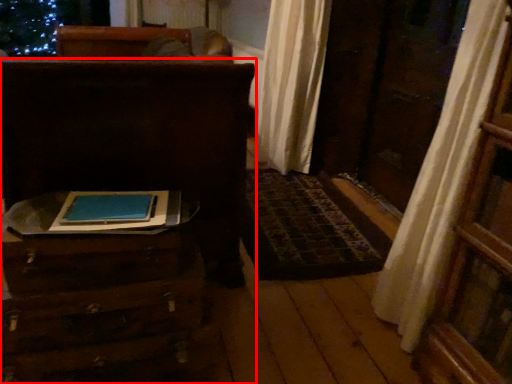
Question: From the image's perspective, where is furniture (annotated by the red box) located in relation to furniture in the image?

Choices:
 (A) below
 (B) above

Answer: (B)